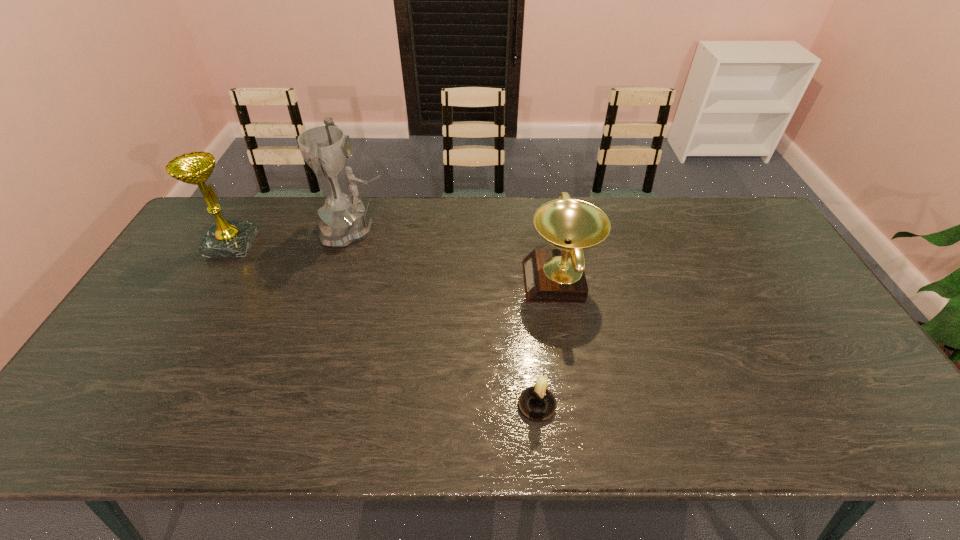
Find the location of a particular element. This screenshot has width=960, height=540. free space that satisfies the following two spatial constraints: 1. on the side with emblem of the shortest object; 2. on the left side of the tallest object is located at coordinates (304, 406).

The width and height of the screenshot is (960, 540). What are the coordinates of `vacant position in the image that satisfies the following two spatial constraints: 1. on the back side of the shortest object; 2. on the side with emblem of the tallest object` in the screenshot? It's located at (520, 230).